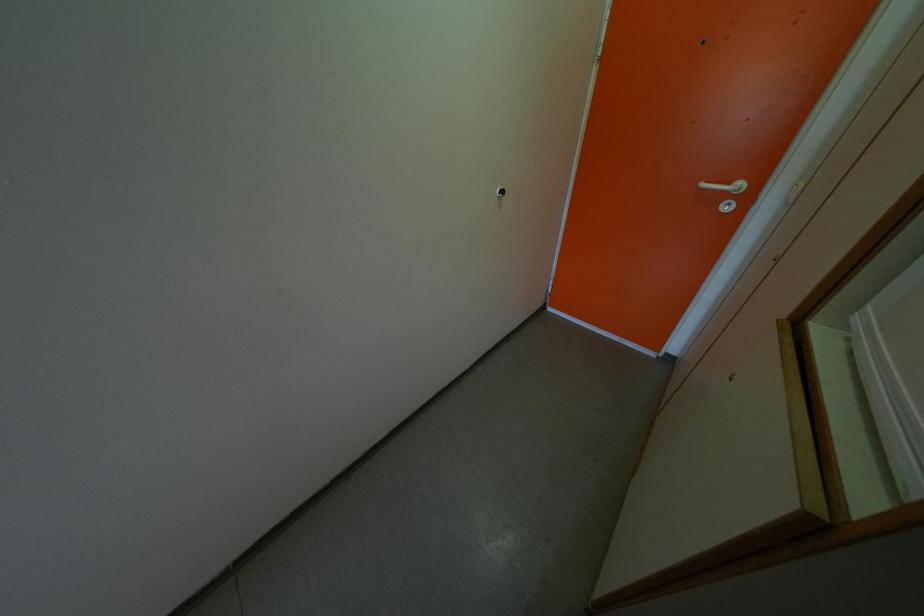
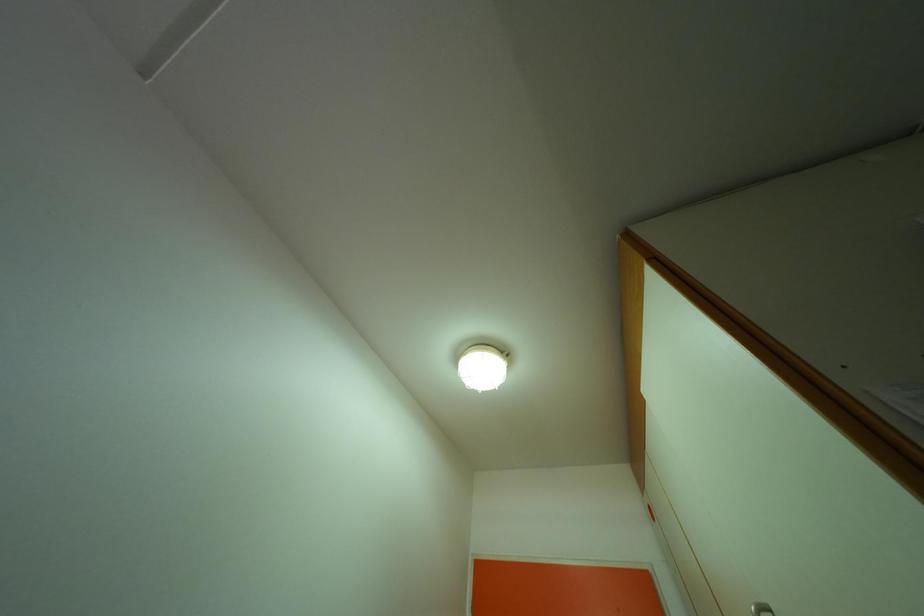
The images are taken continuously from a first-person perspective. In which direction is your viewpoint rotating?

The camera rotated toward right-up.